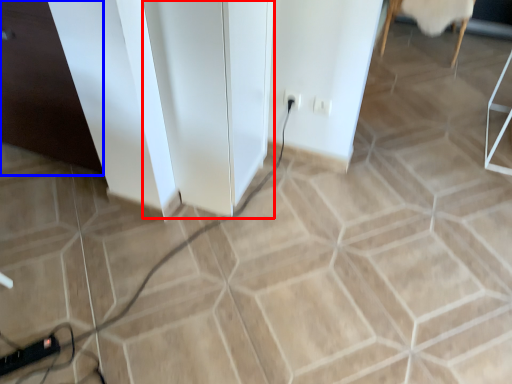
Question: Which object is closer to the camera taking this photo, file cabinet (highlighted by a red box) or file cabinet (highlighted by a blue box)?

Choices:
 (A) file cabinet
 (B) file cabinet

Answer: (A)